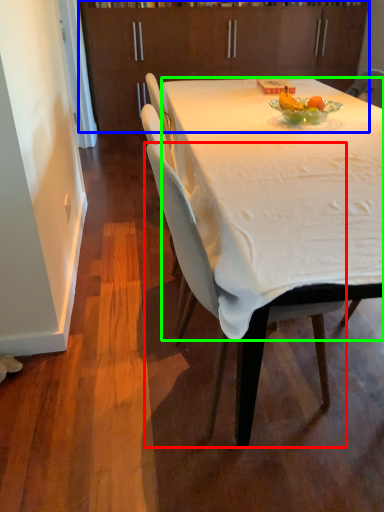
Question: Based on their relative distances, which object is nearer to chair (highlighted by a red box)? Choose from cabinetry (highlighted by a blue box) and desk (highlighted by a green box).

Choices:
 (A) cabinetry
 (B) desk

Answer: (B)